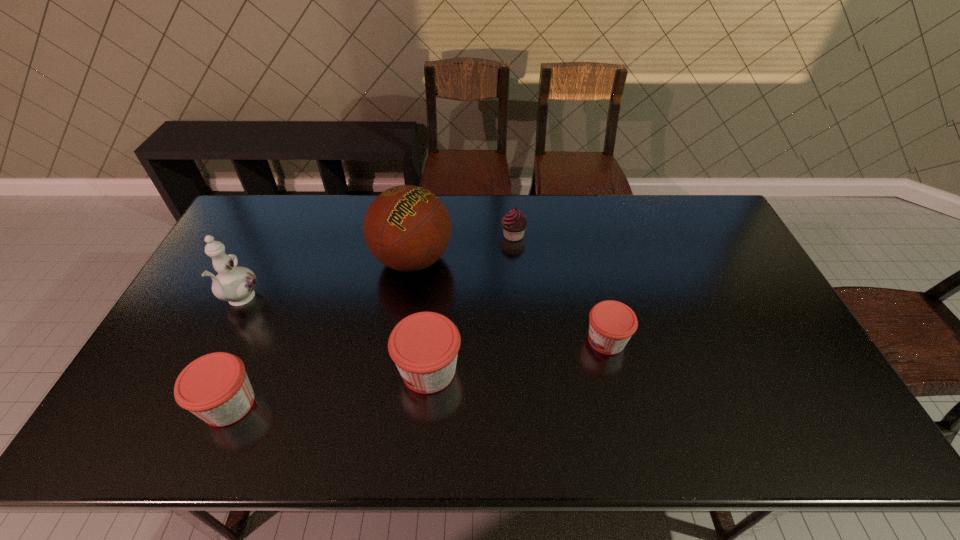
Find the location of `empty location between the basketball and the cupcake`. empty location between the basketball and the cupcake is located at coordinates (463, 247).

Find the location of a particular element. Image resolution: width=960 pixels, height=540 pixels. vacant space that's between the basketball and the rightmost object is located at coordinates (510, 300).

Where is `unoccupied area between the basketball and the rightmost jam`? This screenshot has height=540, width=960. unoccupied area between the basketball and the rightmost jam is located at coordinates (510, 300).

At what (x,y) coordinates should I click in order to perform the action: click on vacant area that lies between the rightmost object and the fifth object from left to right. Please return your answer as a coordinate pair (x, y). Looking at the image, I should click on (560, 288).

Identify which object is the third closest to the basketball. Please provide its 2D coordinates. Your answer should be formatted as a tuple, i.e. [(x, y)], where the tuple contains the x and y coordinates of a point satisfying the conditions above.

[(235, 284)]

Select which object is the second closest to the second jam from right to left. Please provide its 2D coordinates. Your answer should be formatted as a tuple, i.e. [(x, y)], where the tuple contains the x and y coordinates of a point satisfying the conditions above.

[(215, 387)]

What are the coordinates of `jam identified as the closest to the leftmost jam` in the screenshot? It's located at (424, 346).

Identify which jam is located as the nearest to the basketball. Please provide its 2D coordinates. Your answer should be formatted as a tuple, i.e. [(x, y)], where the tuple contains the x and y coordinates of a point satisfying the conditions above.

[(424, 346)]

Locate an element on the screen. The image size is (960, 540). vacant space that satisfies the following two spatial constraints: 1. on the front side of the second object from right to left; 2. on the front label of the second jam from left to right is located at coordinates (524, 370).